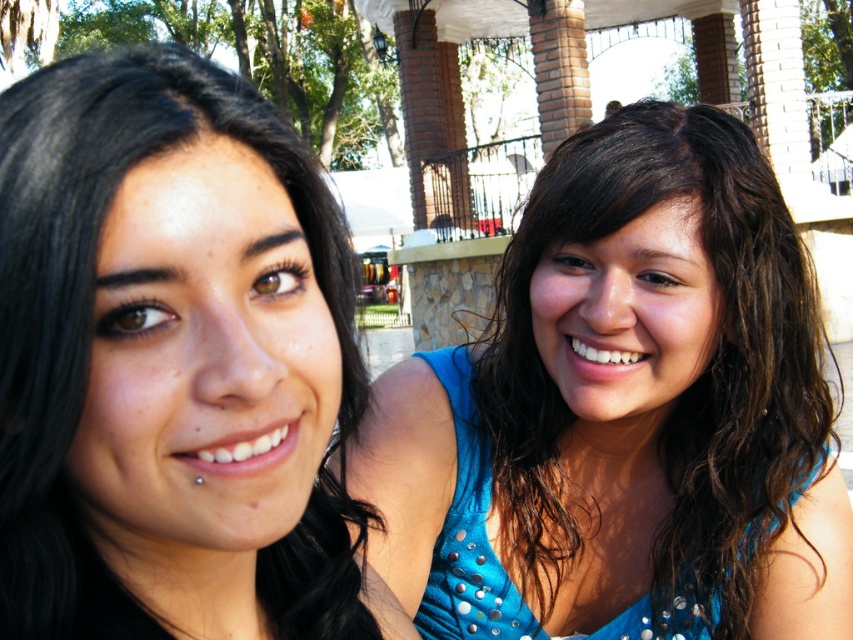
Question: Is blue sequined dress at right bigger than black hair at left?

Choices:
 (A) yes
 (B) no

Answer: (A)

Question: Which point is closer to the camera?

Choices:
 (A) black hair at left
 (B) blue sequined dress at right

Answer: (A)

Question: Which object appears farthest from the camera in this image?

Choices:
 (A) blue sequined dress at right
 (B) black hair at left

Answer: (A)

Question: Can you confirm if blue sequined dress at right is wider than black hair at left?

Choices:
 (A) no
 (B) yes

Answer: (B)

Question: Observing the image, what is the correct spatial positioning of blue sequined dress at right in reference to black hair at left?

Choices:
 (A) left
 (B) right

Answer: (B)